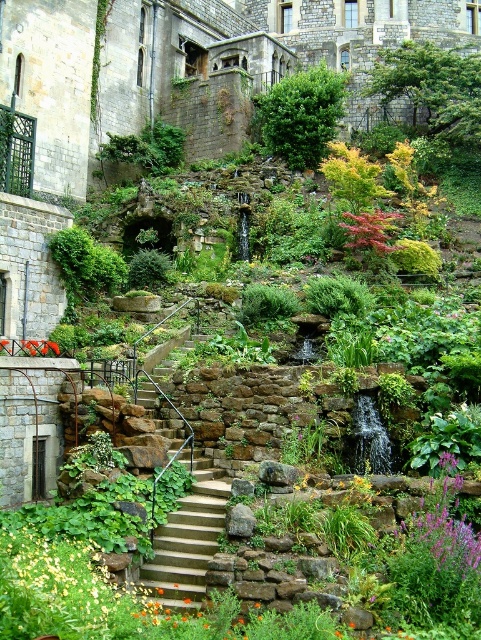
Is smooth concrete stairs at center thinner than purple fuzzy flower at center right?

Incorrect, smooth concrete stairs at center's width is not less than purple fuzzy flower at center right's.

Between smooth concrete stairs at center and purple fuzzy flower at center right, which one appears on the left side from the viewer's perspective?

smooth concrete stairs at center is more to the left.

This screenshot has width=481, height=640. What are the coordinates of `smooth concrete stairs at center` in the screenshot? It's located at (188, 540).

Does smooth concrete stairs at center come behind glossy red leaf at center?

No, smooth concrete stairs at center is in front of glossy red leaf at center.

Is smooth concrete stairs at center closer to camera compared to glossy red leaf at center?

Yes, it is.

Between point (229, 483) and point (354, 232), which one is positioned in front?

Positioned in front is point (229, 483).

Locate an element on the screen. smooth concrete stairs at center is located at coordinates (188, 540).

Is purple fuzzy flower at center right below glossy red leaf at center?

Indeed, purple fuzzy flower at center right is positioned under glossy red leaf at center.

Can you confirm if purple fuzzy flower at center right is shorter than glossy red leaf at center?

Indeed, purple fuzzy flower at center right has a lesser height compared to glossy red leaf at center.

Locate an element on the screen. purple fuzzy flower at center right is located at coordinates (444, 529).

Where is `purple fuzzy flower at center right`? purple fuzzy flower at center right is located at coordinates (444, 529).